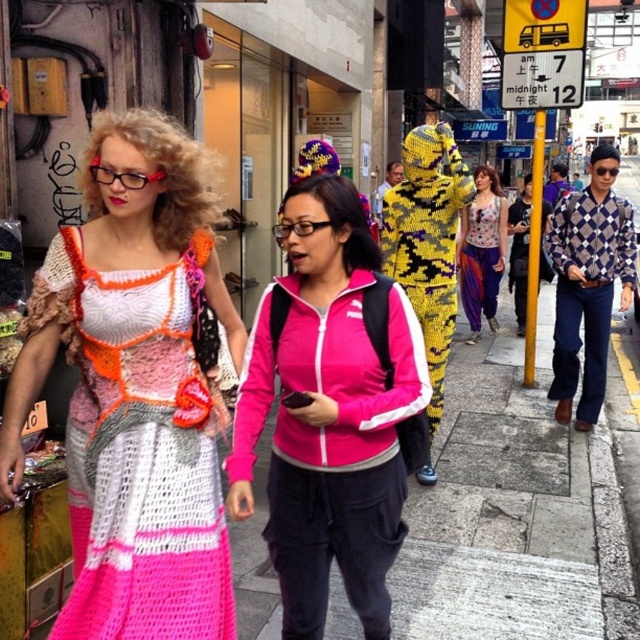
Is gray concrete pavement at center taller than crochet fabric dress at left?

No, gray concrete pavement at center is not taller than crochet fabric dress at left.

Is gray concrete pavement at center closer to the viewer compared to crochet fabric dress at left?

No, gray concrete pavement at center is behind crochet fabric dress at left.

Where is `gray concrete pavement at center`? gray concrete pavement at center is located at coordinates (518, 513).

Can you confirm if crochet fabric dress at left is positioned to the right of printed fabric dress at center?

In fact, crochet fabric dress at left is to the left of printed fabric dress at center.

Does crochet fabric dress at left appear under printed fabric dress at center?

Indeed, crochet fabric dress at left is positioned under printed fabric dress at center.

Does point (216, 602) come in front of point (500, 228)?

That is True.

This screenshot has height=640, width=640. In order to click on crochet fabric dress at left in this screenshot , I will do `click(138, 449)`.

Can you confirm if gray concrete pavement at center is positioned to the left of printed fabric dress at center?

Yes, gray concrete pavement at center is to the left of printed fabric dress at center.

Between gray concrete pavement at center and printed fabric dress at center, which one has more height?

printed fabric dress at center is taller.

Describe the element at coordinates (518, 513) in the screenshot. I see `gray concrete pavement at center` at that location.

Where is `gray concrete pavement at center`? gray concrete pavement at center is located at coordinates (518, 513).